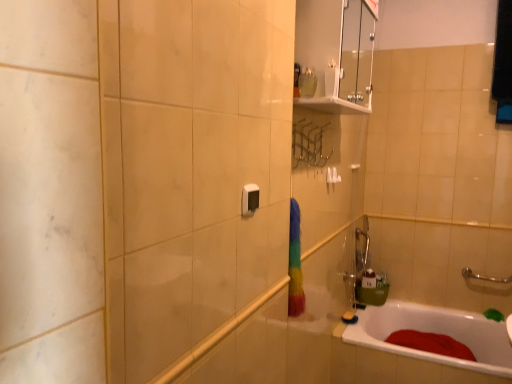
Question: From a real-world perspective, is transparent glass medicine cabinet at upper center under satin black switch at center?

Choices:
 (A) no
 (B) yes

Answer: (A)

Question: Is transparent glass medicine cabinet at upper center closer to the viewer compared to satin black switch at center?

Choices:
 (A) no
 (B) yes

Answer: (A)

Question: Is transparent glass medicine cabinet at upper center oriented away from satin black switch at center?

Choices:
 (A) no
 (B) yes

Answer: (A)

Question: Considering the relative sizes of transparent glass medicine cabinet at upper center and satin black switch at center in the image provided, is transparent glass medicine cabinet at upper center bigger than satin black switch at center?

Choices:
 (A) yes
 (B) no

Answer: (A)

Question: Is transparent glass medicine cabinet at upper center shorter than satin black switch at center?

Choices:
 (A) no
 (B) yes

Answer: (A)

Question: Is transparent glass medicine cabinet at upper center not within satin black switch at center?

Choices:
 (A) yes
 (B) no

Answer: (A)

Question: From a real-world perspective, is satin black switch at center on transparent glass medicine cabinet at upper center?

Choices:
 (A) yes
 (B) no

Answer: (B)

Question: Is satin black switch at center wider than transparent glass medicine cabinet at upper center?

Choices:
 (A) no
 (B) yes

Answer: (A)

Question: Is satin black switch at center facing towards transparent glass medicine cabinet at upper center?

Choices:
 (A) no
 (B) yes

Answer: (A)

Question: Does satin black switch at center have a lesser height compared to transparent glass medicine cabinet at upper center?

Choices:
 (A) no
 (B) yes

Answer: (B)

Question: From the image's perspective, does satin black switch at center appear lower than transparent glass medicine cabinet at upper center?

Choices:
 (A) yes
 (B) no

Answer: (A)

Question: Is satin black switch at center behind transparent glass medicine cabinet at upper center?

Choices:
 (A) yes
 (B) no

Answer: (B)

Question: Does white plastic towel bar at upper center come in front of white glossy bathtub at lower right?

Choices:
 (A) no
 (B) yes

Answer: (A)